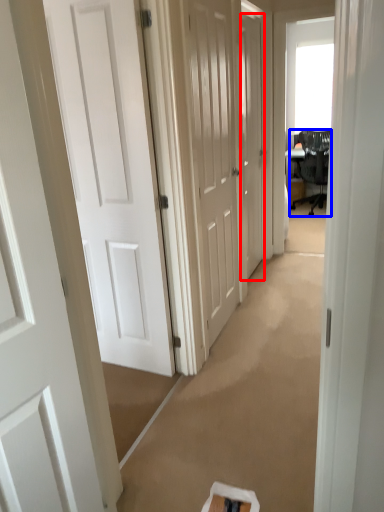
Question: Which object appears closest to the camera in this image, door (highlighted by a red box) or chair (highlighted by a blue box)?

Choices:
 (A) door
 (B) chair

Answer: (A)